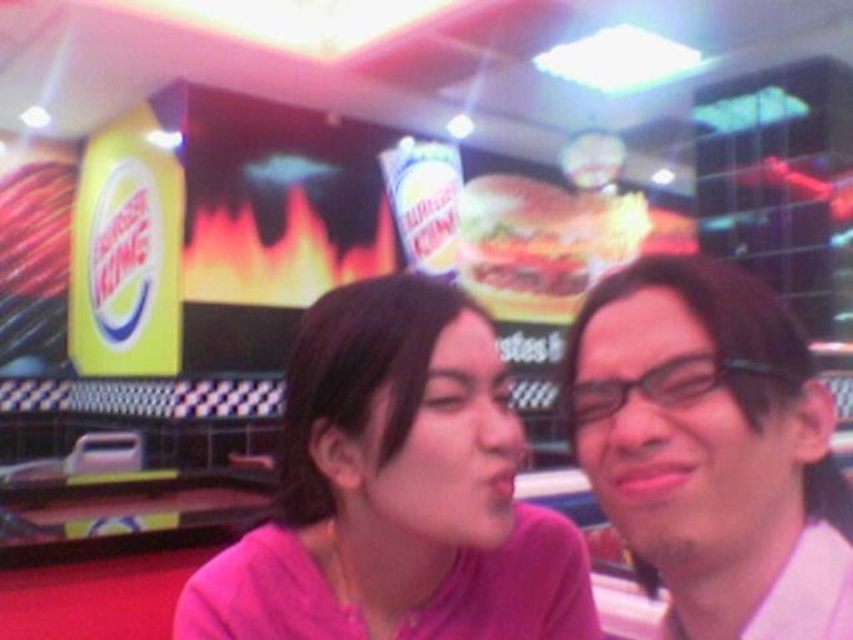
Question: Can you confirm if pink matte shirt at center is wider than matte white glasses at right?

Choices:
 (A) yes
 (B) no

Answer: (A)

Question: From the image, what is the correct spatial relationship of pink matte shirt at center in relation to matte white glasses at right?

Choices:
 (A) above
 (B) below

Answer: (B)

Question: Is pink matte shirt at center to the right of matte white glasses at right from the viewer's perspective?

Choices:
 (A) yes
 (B) no

Answer: (B)

Question: Among these points, which one is nearest to the camera?

Choices:
 (A) (779, 448)
 (B) (555, 596)

Answer: (A)

Question: Which point is closer to the camera?

Choices:
 (A) (751, 312)
 (B) (364, 419)

Answer: (A)